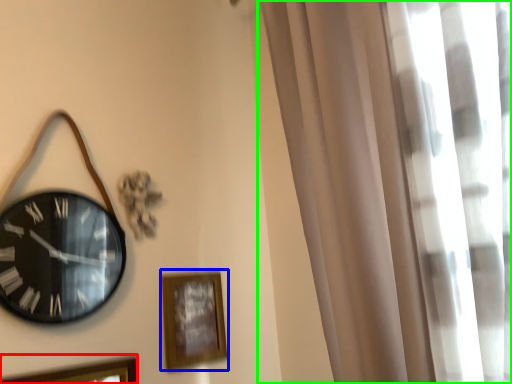
Question: Which object is the farthest from picture frame (highlighted by a red box)? Choose among these: picture frame (highlighted by a blue box) or curtain (highlighted by a green box).

Choices:
 (A) picture frame
 (B) curtain

Answer: (B)